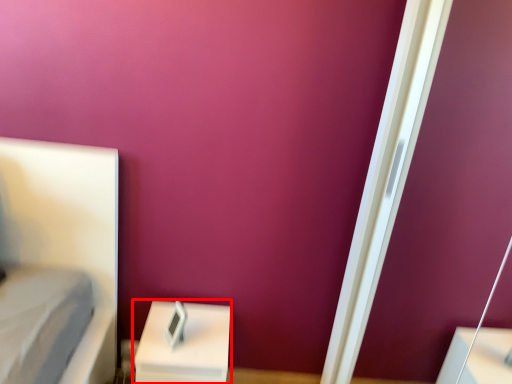
Question: From the image, what is the correct spatial relationship of furniture (annotated by the red box) in relation to screen door?

Choices:
 (A) right
 (B) left

Answer: (B)